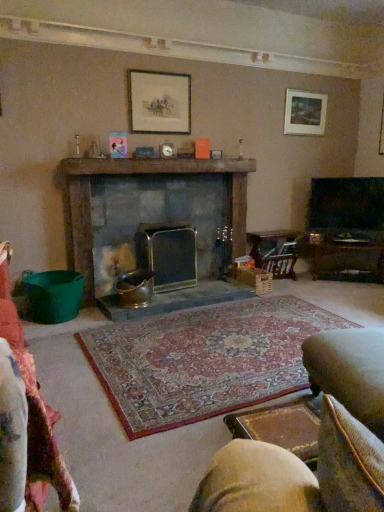
Question: Is wooden magazine rack at center-right situated inside matte wooden picture frame at upper right, which ranks as the first picture frame in right-to-left order, or outside?

Choices:
 (A) outside
 (B) inside

Answer: (A)

Question: From a real-world perspective, is wooden magazine rack at center-right above or below matte wooden picture frame at upper right, which is counted as the 2th picture frame, starting from the front?

Choices:
 (A) below
 (B) above

Answer: (A)

Question: Which of these objects is positioned closest to the leather cushioned swivel chair at lower right, the 1th swivel chair from the left?

Choices:
 (A) velvet beige swivel chair at lower right, placed as the 1th swivel chair when sorted from right to left
 (B) matte wooden picture frame at upper center, the second picture frame viewed from the back
 (C) rustic stone fireplace at center, which is counted as the 1th fireplace, starting from the left
 (D) metallic silver fireplace at center, which is counted as the 1th fireplace, starting from the right
 (E) wooden magazine rack at center-right

Answer: (A)

Question: Based on their relative distances, which object is farther from the velvet beige swivel chair at lower right, placed as the 1th swivel chair when sorted from right to left?

Choices:
 (A) leather cushioned swivel chair at lower right, the first swivel chair from the front
 (B) rustic stone fireplace at center, which is counted as the 1th fireplace, starting from the left
 (C) matte wooden picture frame at upper center, which is the second picture frame in right-to-left order
 (D) matte wooden picture frame at upper right, which is counted as the 2th picture frame, starting from the front
 (E) metallic silver fireplace at center, the second fireplace viewed from the left

Answer: (D)